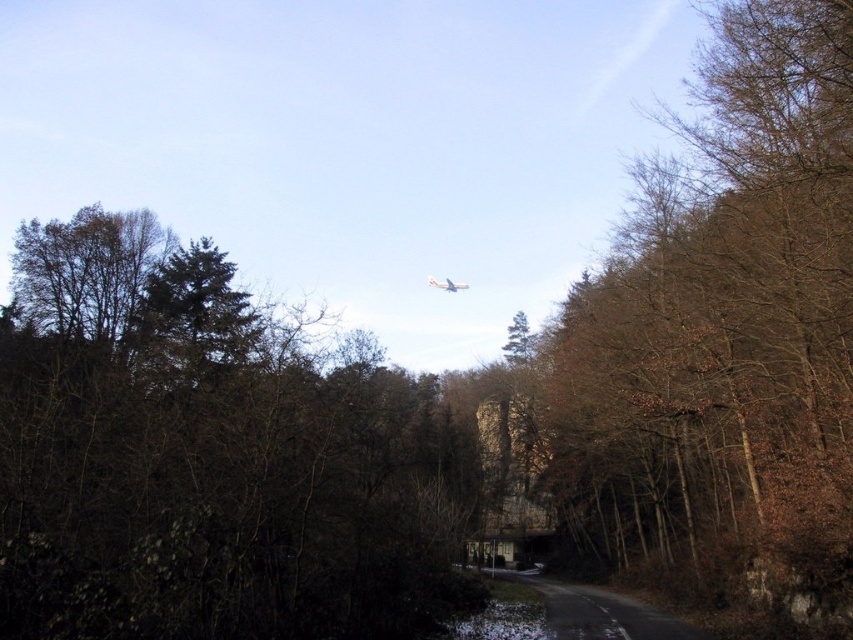
Based on the photo, you are a hiker standing on the dark, narrow road in the foreground of the scene. You want to walk towards the brown leafy tree at upper center and the brown leafy tree at center. Which tree will you reach first?

The brown leafy tree at center is closer to you than the brown leafy tree at upper center, so you will reach the brown leafy tree at center first.

In the scene shown: You are standing at the point marked as point (207, 458) in the image. What object is exactly at that location?

The brown leafy tree at upper center is exactly at point (207, 458).